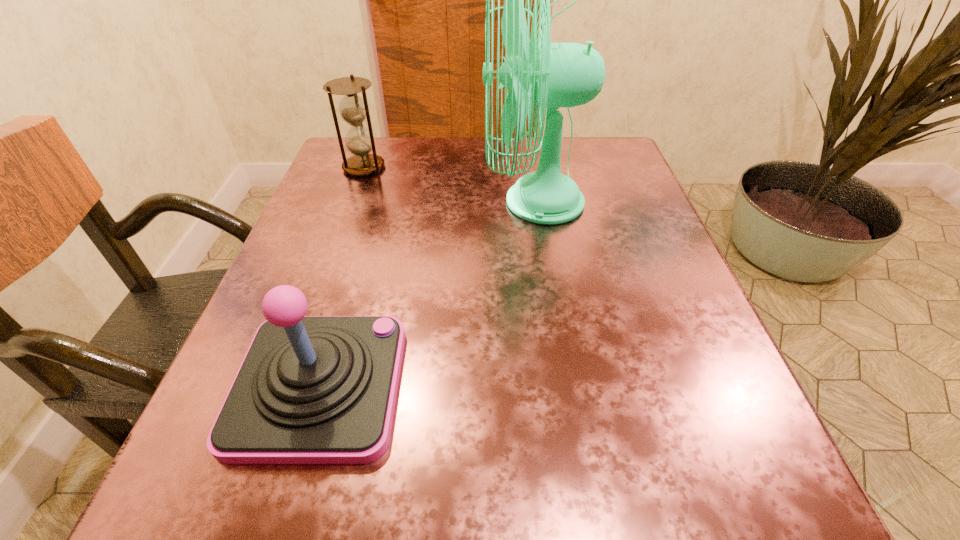
Locate an element on the screen. vacant region at the left edge of the desktop is located at coordinates (351, 305).

This screenshot has width=960, height=540. I want to click on free space at the right edge, so [x=594, y=274].

Locate an element on the screen. This screenshot has height=540, width=960. free space at the far left corner of the desktop is located at coordinates (389, 186).

At what (x,y) coordinates should I click in order to perform the action: click on vacant space that's between the joystick and the hourglass. Please return your answer as a coordinate pair (x, y). This screenshot has height=540, width=960. Looking at the image, I should click on (342, 276).

Image resolution: width=960 pixels, height=540 pixels. In order to click on vacant area that lies between the hourglass and the nearest object in this screenshot , I will do `click(342, 276)`.

This screenshot has height=540, width=960. I want to click on vacant space in between the rightmost object and the nearest object, so click(426, 294).

I want to click on unoccupied position between the hourglass and the tallest object, so click(x=448, y=185).

Find the location of a particular element. vacant area between the hourglass and the nearest object is located at coordinates (342, 276).

Identify the location of empty space that is in between the hourglass and the joystick. (342, 276).

You are a GUI agent. You are given a task and a screenshot of the screen. Output one action in this format:
    pyautogui.click(x=<x>, y=<y>)
    Task: Click on the empty space that is in between the tallest object and the hourglass
    The height and width of the screenshot is (540, 960).
    Given the screenshot: What is the action you would take?
    pyautogui.click(x=448, y=185)